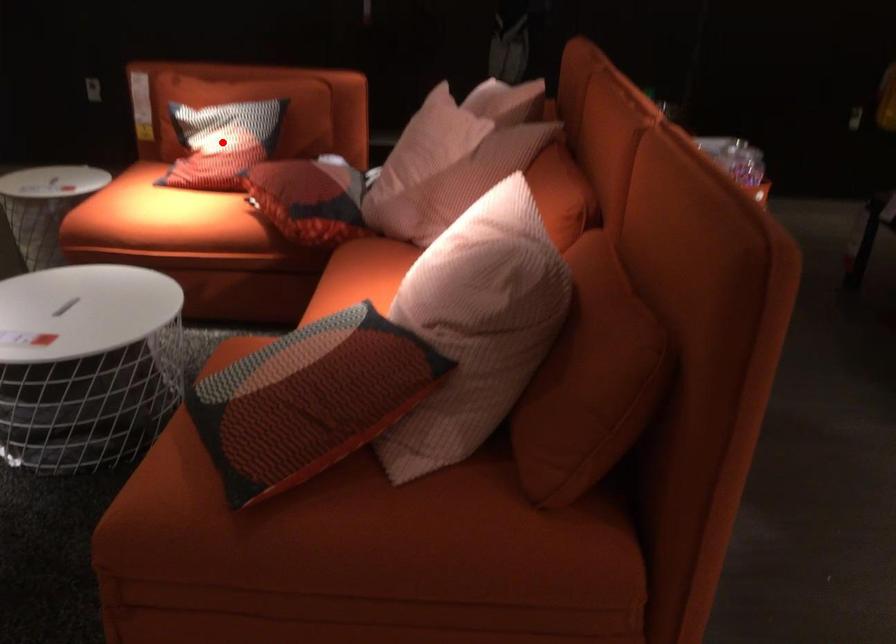
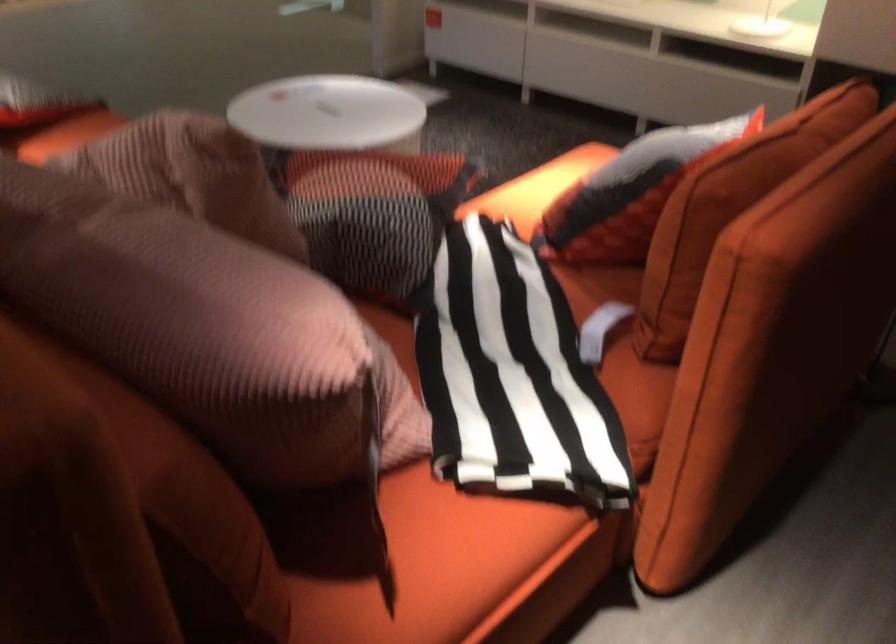
Question: I am providing you with two images of the same scene from different viewpoints. A red point is marked on the first image. At the location where the point appears in image 1, is it still visible in image 2?

Choices:
 (A) Yes
 (B) No

Answer: (B)